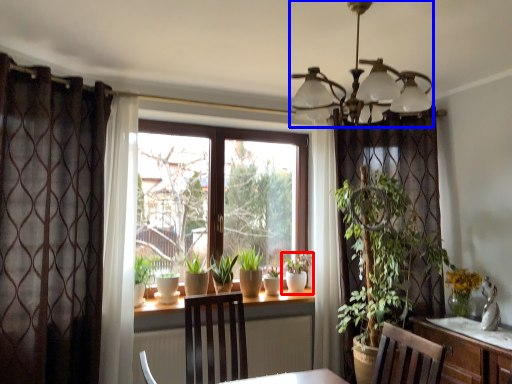
Question: Which object appears closest to the camera in this image, houseplant (highlighted by a red box) or light fixture (highlighted by a blue box)?

Choices:
 (A) houseplant
 (B) light fixture

Answer: (B)